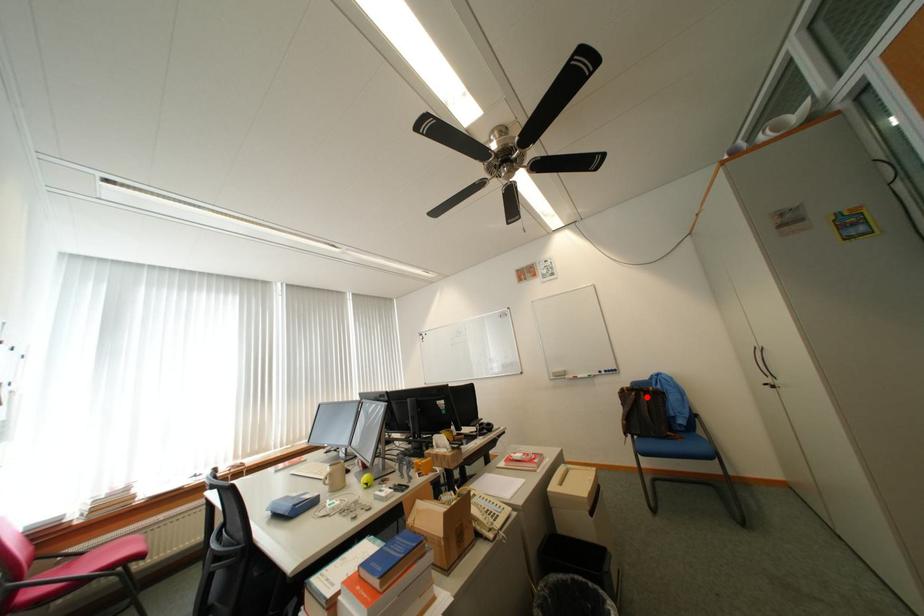
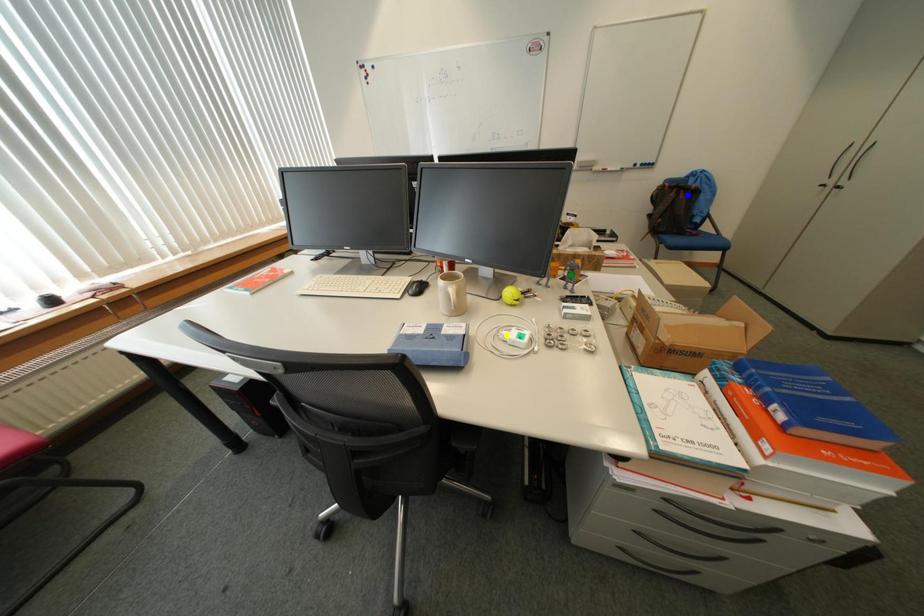
Question: I am providing you with two images of the same scene from different viewpoints. A red point is marked on the first image. You are given multiple points on the second image. In image 2, which mark is for the same physical point as the one in image 1?

Choices:
 (A) yellow point
 (B) green point
 (C) blue point

Answer: (C)